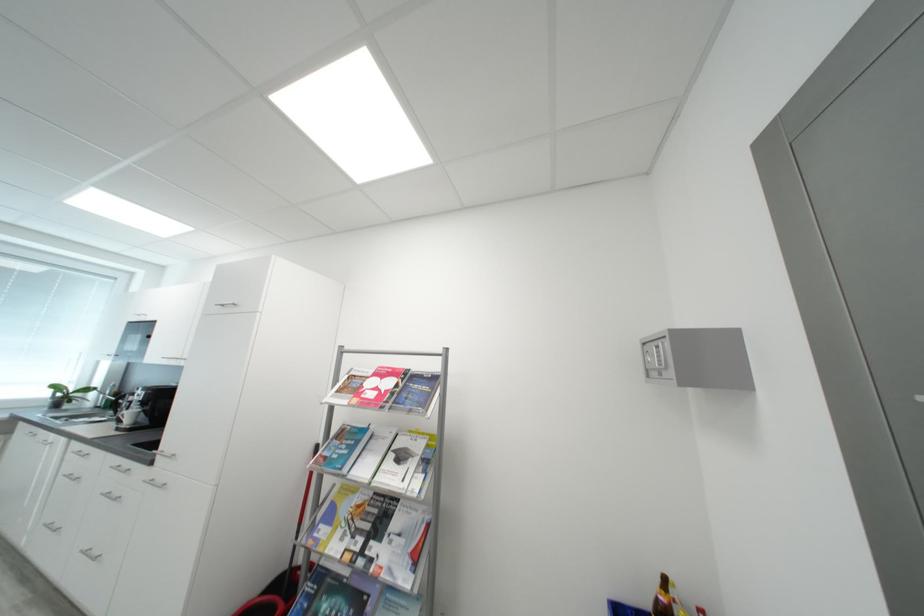
Where is `silver faucet handle`? The width and height of the screenshot is (924, 616). silver faucet handle is located at coordinates 115,400.